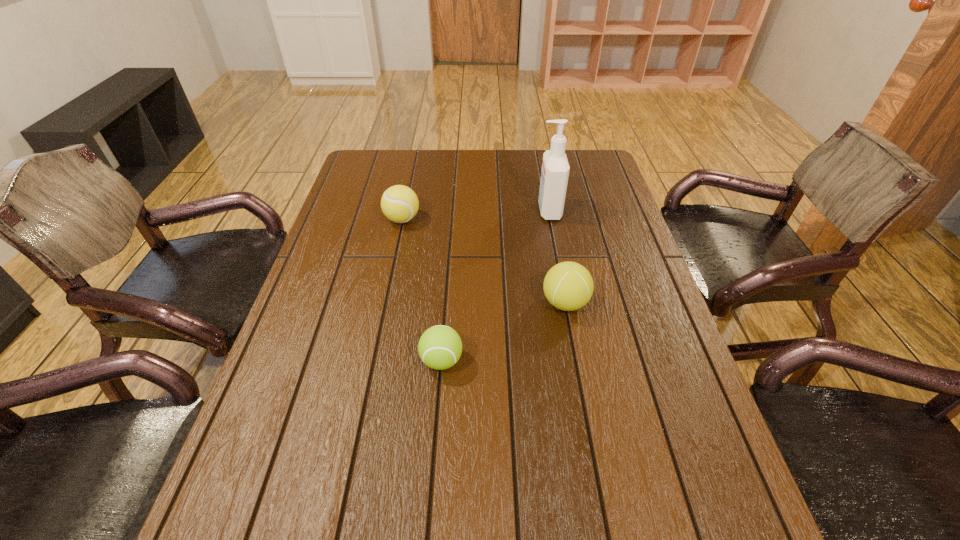
Where is `vacant space situated 0.120m on the back of the second nearest object`? vacant space situated 0.120m on the back of the second nearest object is located at coordinates (556, 256).

This screenshot has height=540, width=960. I want to click on free space located on the front of the leftmost object, so click(x=386, y=299).

Identify the location of vacant region located on the front of the shortest object. This screenshot has width=960, height=540. (434, 462).

Where is `object at the left edge`? This screenshot has width=960, height=540. object at the left edge is located at coordinates (399, 203).

Identify the location of free space at the far edge of the desktop. (425, 183).

Where is `vacant space at the left edge of the desktop`? vacant space at the left edge of the desktop is located at coordinates (354, 255).

Locate an element on the screen. free space at the right edge of the desktop is located at coordinates (676, 456).

You are a GUI agent. You are given a task and a screenshot of the screen. Output one action in this format:
    pyautogui.click(x=<x>, y=<y>)
    Task: Click on the empty space that is in between the second nearest object and the farthest tennis ball
    
    Given the screenshot: What is the action you would take?
    pyautogui.click(x=484, y=261)

In order to click on free space that is in between the leftmost object and the second nearest object in this screenshot , I will do `click(484, 261)`.

This screenshot has height=540, width=960. I want to click on free space between the tallest object and the leftmost tennis ball, so click(475, 215).